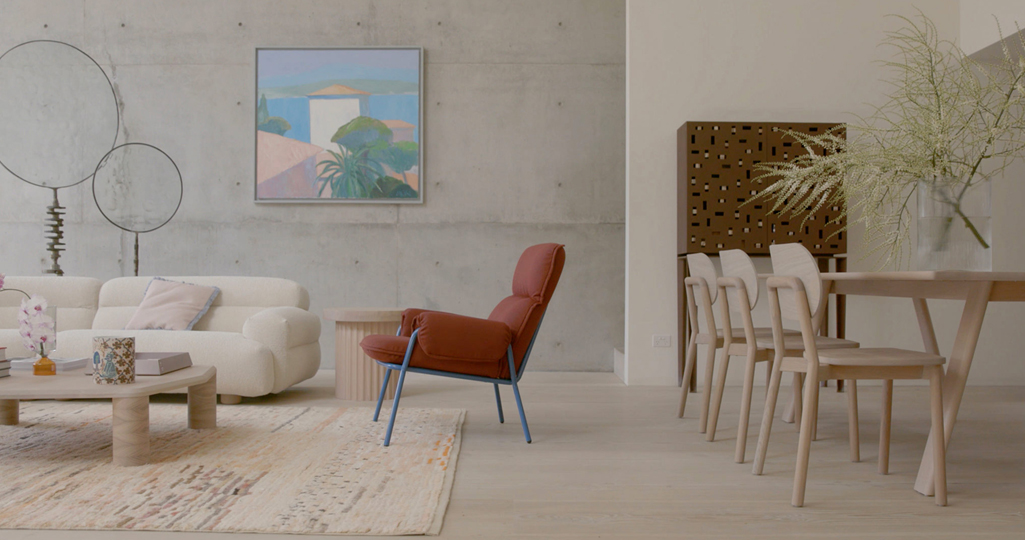
Locate an element on the screen. matching chairs is located at coordinates (698, 272), (747, 271), (794, 267).